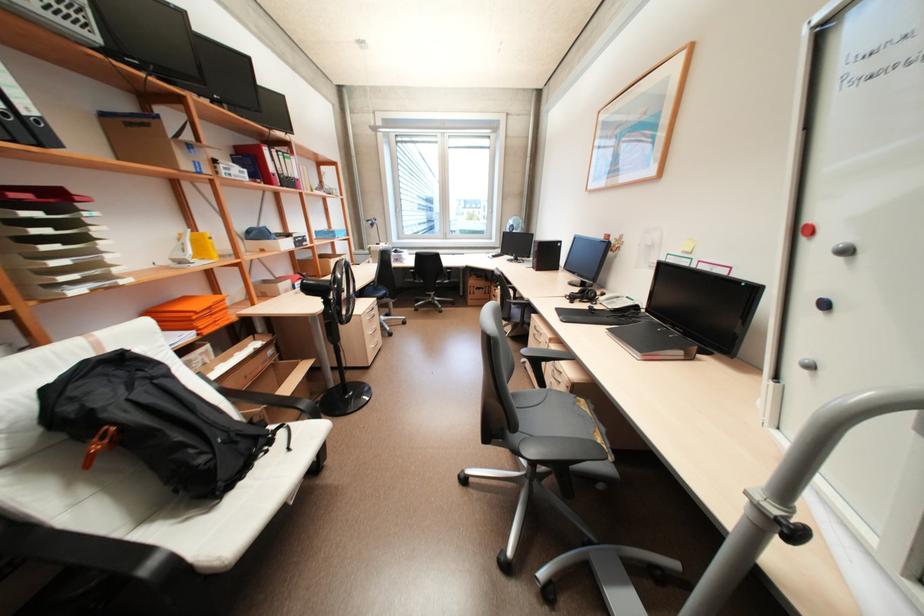
What do you see at coordinates (96, 446) in the screenshot? The image size is (924, 616). I see `the orange backpack handle` at bounding box center [96, 446].